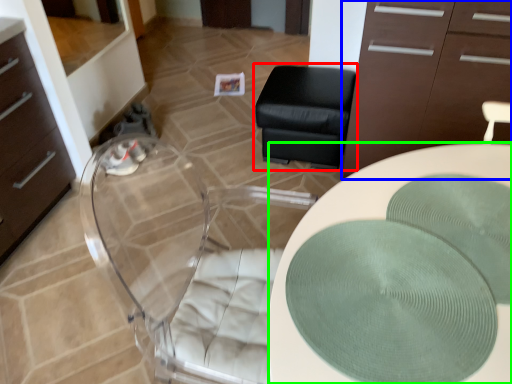
Question: Estimate the real-world distances between objects in this image. Which object is closer to furniture (highlighted by a red box), cabinetry (highlighted by a blue box) or desk (highlighted by a green box)?

Choices:
 (A) cabinetry
 (B) desk

Answer: (A)